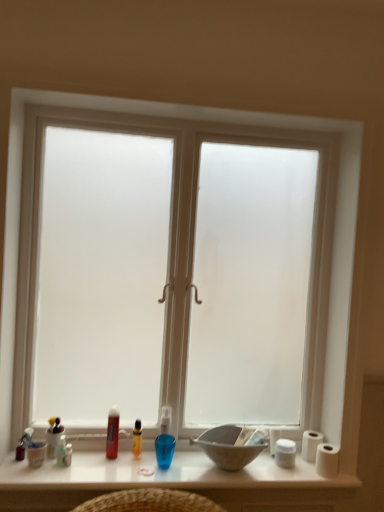
Where is `vacant point to the left of translucent plastic bottle at lower left, which is counted as the 3th toiletry, starting from the left`? vacant point to the left of translucent plastic bottle at lower left, which is counted as the 3th toiletry, starting from the left is located at coordinates (25, 468).